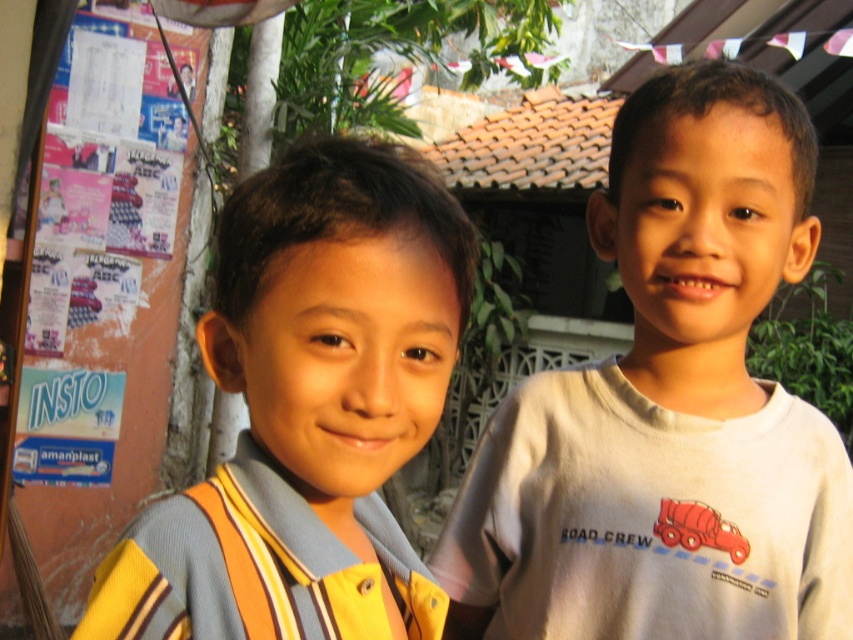
Question: Among these points, which one is nearest to the camera?

Choices:
 (A) (729, 156)
 (B) (140, 618)
 (C) (45, 131)

Answer: (B)

Question: Does white cotton shirt at right appear over yellow striped shirt at center?

Choices:
 (A) no
 (B) yes

Answer: (A)

Question: Based on their relative distances, which object is farther from the white cotton shirt at right?

Choices:
 (A) orange paper posters at left
 (B) yellow striped shirt at center

Answer: (A)

Question: Which object is closer to the camera taking this photo?

Choices:
 (A) orange paper posters at left
 (B) yellow striped shirt at center

Answer: (B)

Question: Observing the image, what is the correct spatial positioning of yellow striped shirt at center in reference to orange paper posters at left?

Choices:
 (A) left
 (B) right

Answer: (B)

Question: Is yellow striped shirt at center to the right of orange paper posters at left from the viewer's perspective?

Choices:
 (A) yes
 (B) no

Answer: (A)